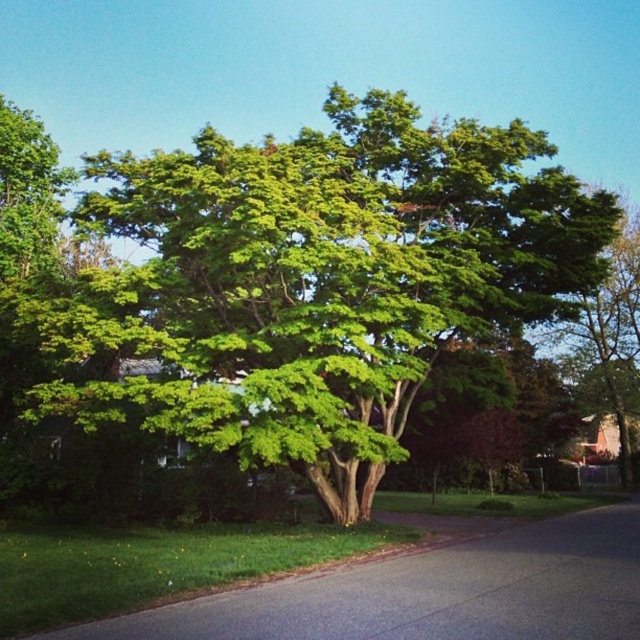
Question: Does green leafy tree at center lie behind green leafy tree at right?

Choices:
 (A) yes
 (B) no

Answer: (B)

Question: Is green leafy tree at center to the right of green leafy tree at right from the viewer's perspective?

Choices:
 (A) no
 (B) yes

Answer: (A)

Question: Is green leafy tree at center in front of green leafy tree at right?

Choices:
 (A) yes
 (B) no

Answer: (A)